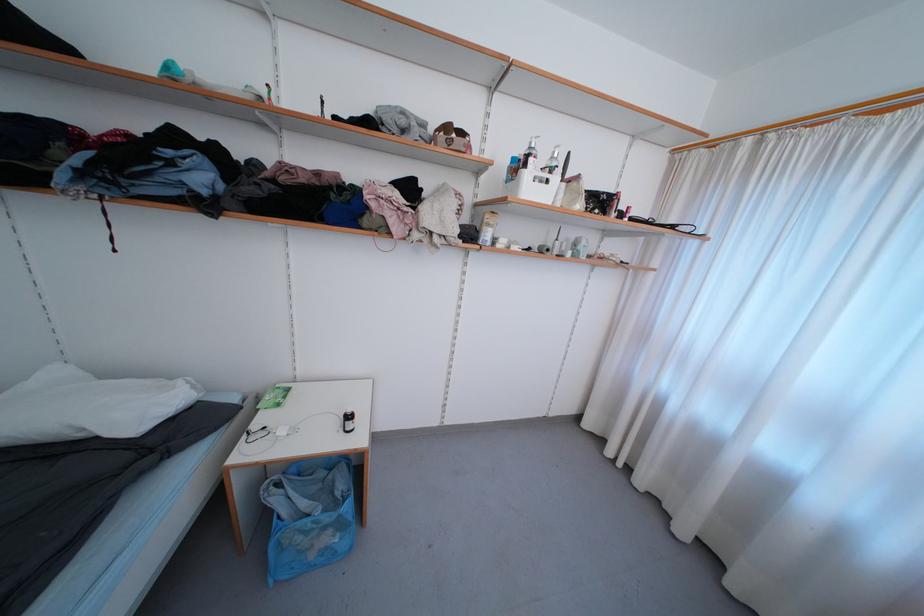
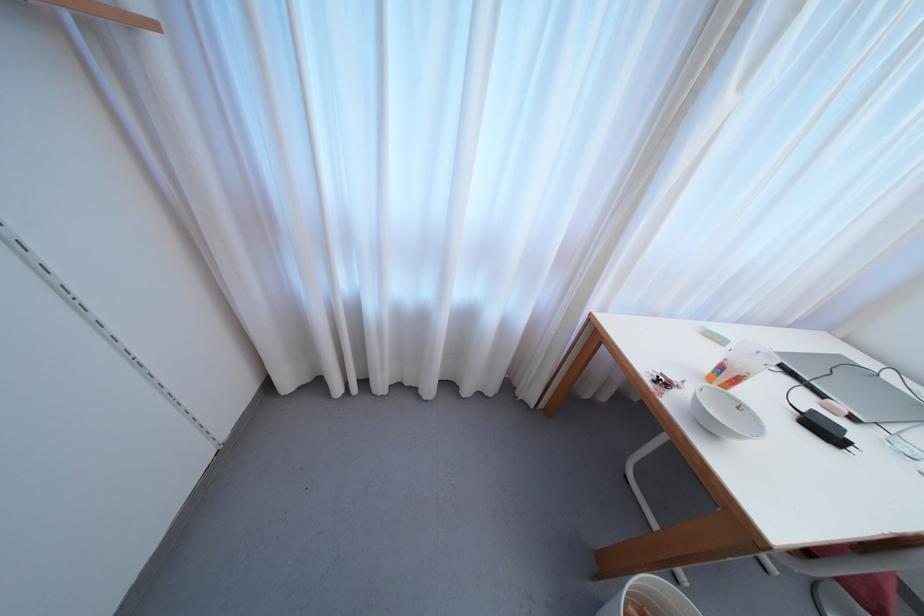
How did the camera likely rotate?

The rotation direction of the camera is right-down.